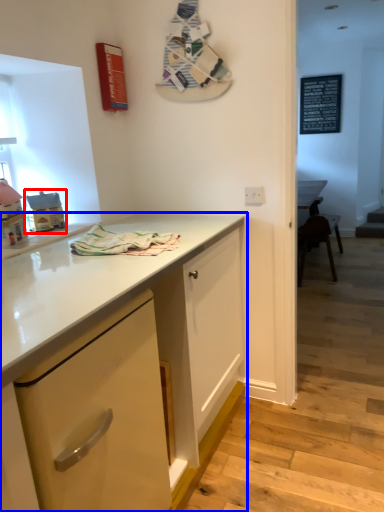
Question: Which object is further to the camera taking this photo, toy (highlighted by a red box) or cabinetry (highlighted by a blue box)?

Choices:
 (A) toy
 (B) cabinetry

Answer: (A)